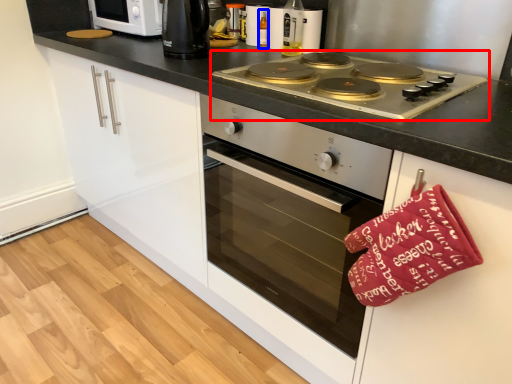
Question: Which object appears closest to the camera in this image, gas stove (highlighted by a red box) or bottle (highlighted by a blue box)?

Choices:
 (A) gas stove
 (B) bottle

Answer: (A)